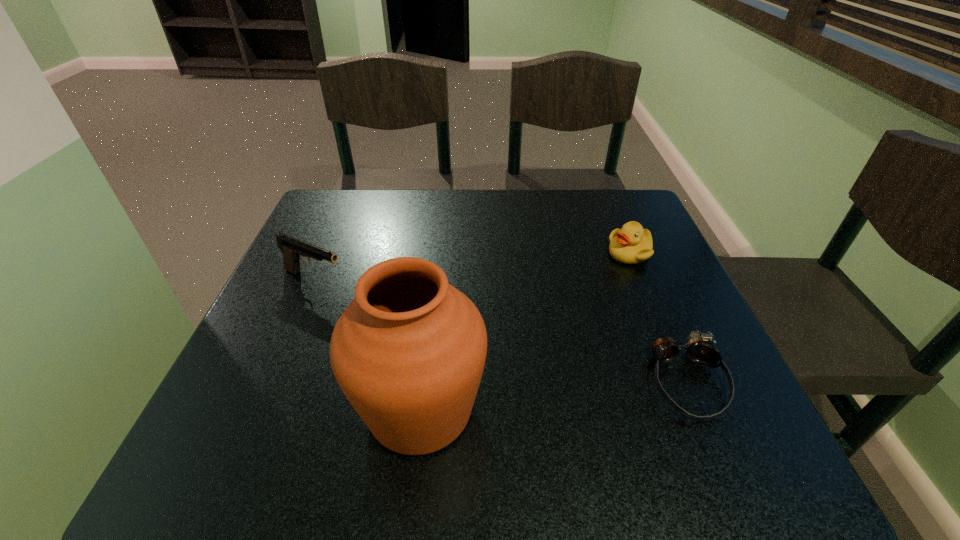
Where is `the second object from left to right`? The width and height of the screenshot is (960, 540). the second object from left to right is located at coordinates (409, 351).

This screenshot has width=960, height=540. In order to click on the tallest object in this screenshot , I will do (409, 351).

Locate an element on the screen. This screenshot has width=960, height=540. the shortest object is located at coordinates (700, 350).

Image resolution: width=960 pixels, height=540 pixels. Find the location of `duckling`. duckling is located at coordinates (631, 244).

The height and width of the screenshot is (540, 960). In order to click on pistol in this screenshot , I will do `click(293, 249)`.

Where is `the leftmost object`? Image resolution: width=960 pixels, height=540 pixels. the leftmost object is located at coordinates (293, 249).

This screenshot has height=540, width=960. What are the coordinates of `free spot located on the back of the tallest object` in the screenshot? It's located at (x=435, y=285).

Locate an element on the screen. The image size is (960, 540). vacant space situated 0.230m on the front-facing side of the second shortest object is located at coordinates (582, 327).

The width and height of the screenshot is (960, 540). In order to click on free space located on the front-facing side of the second shortest object in this screenshot , I will do `click(571, 343)`.

Where is `free space located 0.320m on the front-facing side of the second shortest object`? free space located 0.320m on the front-facing side of the second shortest object is located at coordinates (562, 357).